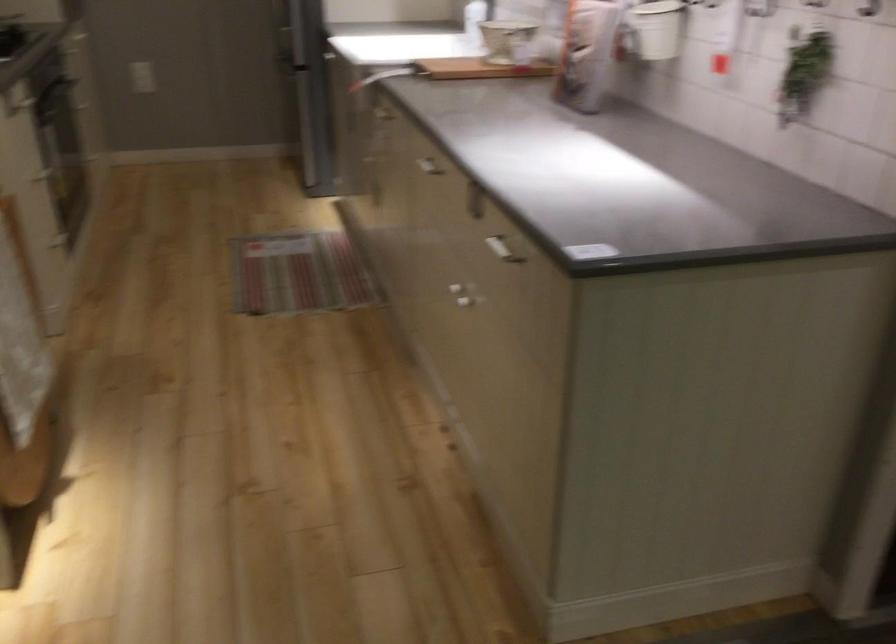
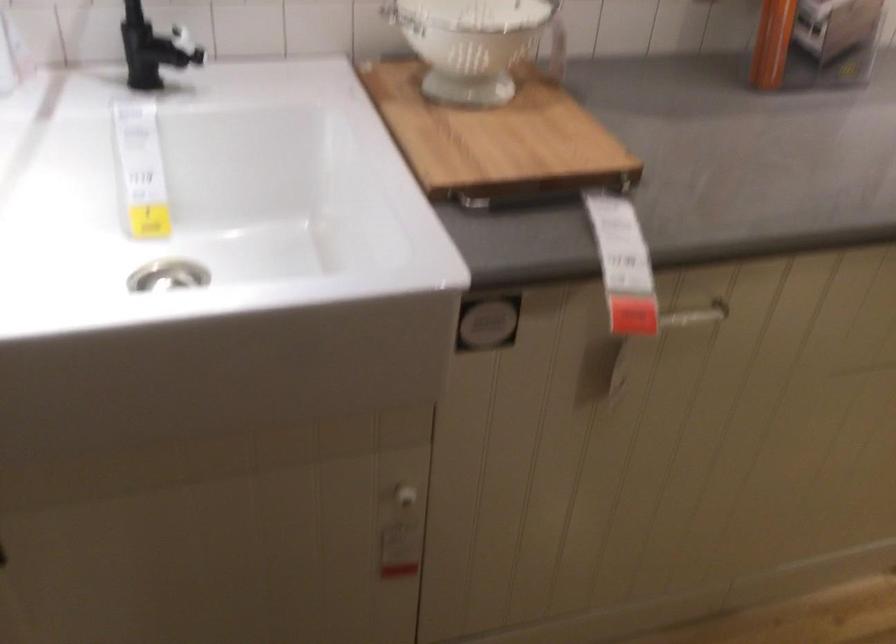
The point at [375,167] is marked in the first image. Where is the corresponding point in the second image?

(403, 497)